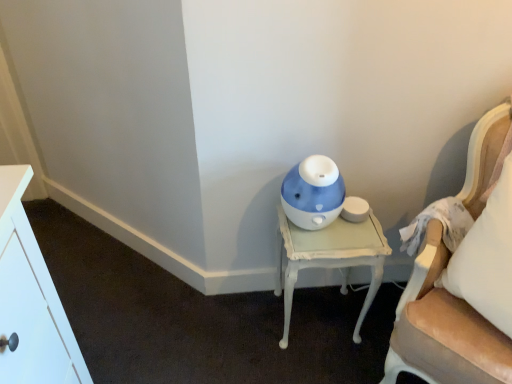
Where is `vacant area that is in front of blue glossy humidifier at center`? The image size is (512, 384). vacant area that is in front of blue glossy humidifier at center is located at coordinates (319, 245).